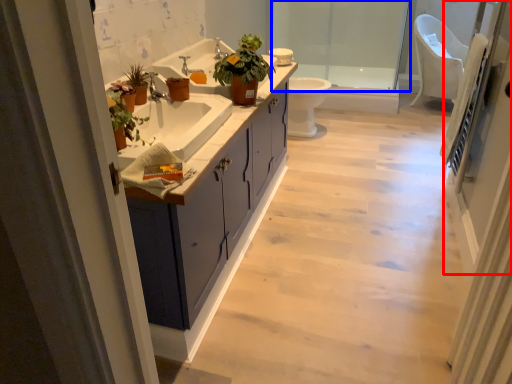
Question: Which object is closer to the camera taking this photo, screen door (highlighted by a red box) or shower door (highlighted by a blue box)?

Choices:
 (A) screen door
 (B) shower door

Answer: (A)